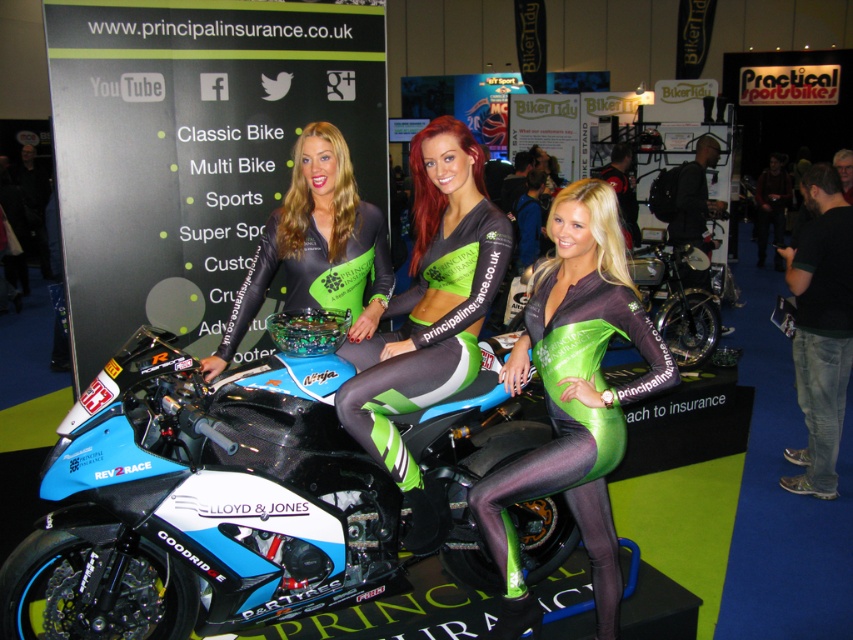
From the picture: Who is higher up, green shiny bodysuit at center or green matte jersey at center?

green matte jersey at center is higher up.

Between green shiny bodysuit at center and green matte jersey at center, which one is positioned lower?

green shiny bodysuit at center is below.

This screenshot has height=640, width=853. Describe the element at coordinates (572, 397) in the screenshot. I see `green shiny bodysuit at center` at that location.

Where is `green shiny bodysuit at center`? This screenshot has width=853, height=640. green shiny bodysuit at center is located at coordinates (572, 397).

Does green shiny bodysuit at center appear under matte black motorcycle at center?

Indeed, green shiny bodysuit at center is positioned under matte black motorcycle at center.

Can you confirm if green shiny bodysuit at center is shorter than matte black motorcycle at center?

Incorrect, green shiny bodysuit at center's height does not fall short of matte black motorcycle at center's.

Who is more forward, (495, 544) or (651, 205)?

Point (495, 544) is more forward.

Locate an element on the screen. Image resolution: width=853 pixels, height=640 pixels. green shiny bodysuit at center is located at coordinates (572, 397).

Between green shiny bodysuit at center and green matte leggings at center, which one appears on the right side from the viewer's perspective?

green shiny bodysuit at center is more to the right.

Does green shiny bodysuit at center appear under green matte leggings at center?

Yes, green shiny bodysuit at center is below green matte leggings at center.

Where is `green shiny bodysuit at center`? This screenshot has width=853, height=640. green shiny bodysuit at center is located at coordinates (572, 397).